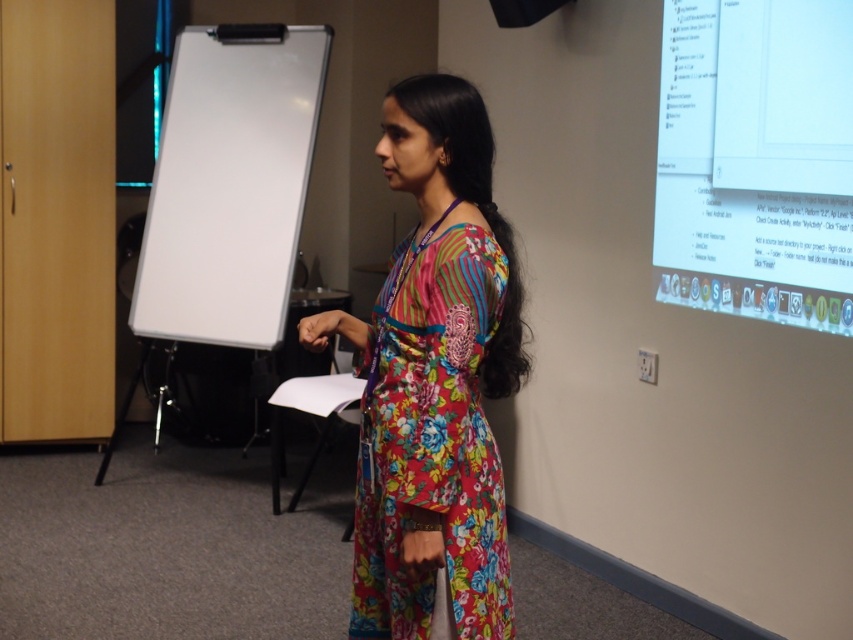
Is point (399, 140) less distant than point (685, 68)?

Yes, it is in front of point (685, 68).

Is point (404, 147) in front of point (828, 145)?

Yes, point (404, 147) is closer to viewer.

The width and height of the screenshot is (853, 640). I want to click on floral fabric dress at center, so click(x=434, y=378).

Describe the element at coordinates (434, 378) in the screenshot. I see `floral fabric dress at center` at that location.

Does point (370, 492) come in front of point (270, 282)?

That is True.

This screenshot has height=640, width=853. What are the coordinates of `floral fabric dress at center` in the screenshot? It's located at (434, 378).

Consider the image. Does white glossy screen at upper right have a lesser width compared to white matte board at left?

Yes.

Is white glossy screen at upper right to the left of white matte board at left from the viewer's perspective?

Incorrect, white glossy screen at upper right is not on the left side of white matte board at left.

Locate an element on the screen. white glossy screen at upper right is located at coordinates (756, 160).